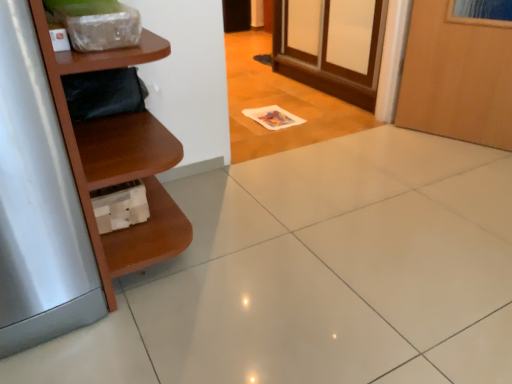
Question: From the image's perspective, is brown wood shelf at left located above or below brushed metal refrigerator at left?

Choices:
 (A) above
 (B) below

Answer: (A)

Question: Considering the positions of brown wood shelf at left and brushed metal refrigerator at left in the image, is brown wood shelf at left bigger or smaller than brushed metal refrigerator at left?

Choices:
 (A) big
 (B) small

Answer: (A)

Question: Is point (133, 145) positioned closer to the camera than point (40, 74)?

Choices:
 (A) farther
 (B) closer

Answer: (A)

Question: Is brushed metal refrigerator at left spatially inside brown wood shelf at left, or outside of it?

Choices:
 (A) outside
 (B) inside

Answer: (A)

Question: Considering the positions of brushed metal refrigerator at left and brown wood shelf at left in the image, is brushed metal refrigerator at left bigger or smaller than brown wood shelf at left?

Choices:
 (A) small
 (B) big

Answer: (A)

Question: Is brushed metal refrigerator at left taller or shorter than brown wood shelf at left?

Choices:
 (A) tall
 (B) short

Answer: (A)

Question: From a real-world perspective, relative to brown wood shelf at left, is brushed metal refrigerator at left vertically above or below?

Choices:
 (A) above
 (B) below

Answer: (B)